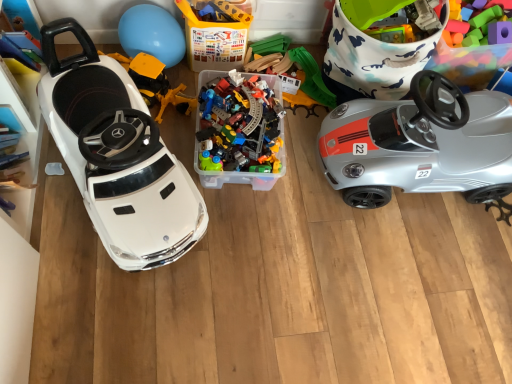
Measure the distance between translucent plastic container at center and camera.

translucent plastic container at center and camera are 4.54 feet apart from each other.

The width and height of the screenshot is (512, 384). What are the coordinates of `white plastic car at left, the 1th car in the left-to-right sequence` in the screenshot? It's located at (118, 156).

The image size is (512, 384). Describe the element at coordinates (118, 156) in the screenshot. I see `white plastic car at left, the 1th car in the left-to-right sequence` at that location.

Describe the element at coordinates (469, 62) in the screenshot. I see `rubberized plastic steering wheel at upper right, acting as the 1th toy starting from the right` at that location.

You are a GUI agent. You are given a task and a screenshot of the screen. Output one action in this format:
    pyautogui.click(x=<x>, y=<y>)
    Task: Click on the translucent plastic container at center
    The image size is (512, 384).
    Given the screenshot: What is the action you would take?
    pyautogui.click(x=215, y=38)

Which is more to the left, rubberized plastic steering wheel at upper right, acting as the 1th toy starting from the right, or blue rubber balloon at upper center?

blue rubber balloon at upper center.

Considering the sizes of objects rubberized plastic steering wheel at upper right, acting as the third toy starting from the left, and blue rubber balloon at upper center in the image provided, who is taller, rubberized plastic steering wheel at upper right, acting as the third toy starting from the left, or blue rubber balloon at upper center?

rubberized plastic steering wheel at upper right, acting as the third toy starting from the left.

Is rubberized plastic steering wheel at upper right, acting as the 1th toy starting from the right, positioned before blue rubber balloon at upper center?

Yes, the depth of rubberized plastic steering wheel at upper right, acting as the 1th toy starting from the right, is less than that of blue rubber balloon at upper center.

Can blue rubber balloon at upper center be found inside white plastic car at left, the 1th car in the left-to-right sequence?

No, blue rubber balloon at upper center is not surrounded by white plastic car at left, the 1th car in the left-to-right sequence.

Which object is wider, white plastic car at left, the 1th car in the left-to-right sequence, or blue rubber balloon at upper center?

With larger width is white plastic car at left, the 1th car in the left-to-right sequence.

What's the angular difference between white plastic car at left, which is the 2th car from right to left, and blue rubber balloon at upper center's facing directions?

The facing directions of white plastic car at left, which is the 2th car from right to left, and blue rubber balloon at upper center are 21.9 degrees apart.

Locate an element on the screen. The width and height of the screenshot is (512, 384). car that is on the left side of blue rubber balloon at upper center is located at coordinates [x=118, y=156].

Considering the relative positions of silver metallic car at right, placed as the 1th car when sorted from right to left, and white plastic car at left, the 1th car in the left-to-right sequence, in the image provided, is silver metallic car at right, placed as the 1th car when sorted from right to left, in front of white plastic car at left, the 1th car in the left-to-right sequence,?

No, it is behind white plastic car at left, the 1th car in the left-to-right sequence.

Locate an element on the screen. car to the right of white plastic car at left, which is the 2th car from right to left is located at coordinates (420, 144).

Which of these two, silver metallic car at right, marked as the second car in a left-to-right arrangement, or white plastic car at left, the 1th car in the left-to-right sequence, is thinner?

silver metallic car at right, marked as the second car in a left-to-right arrangement, is thinner.

Are silver metallic car at right, marked as the second car in a left-to-right arrangement, and white plastic car at left, the 1th car in the left-to-right sequence, far apart?

They are positioned close to each other.

Which of these two, translucent plastic container at center or white plastic car at left, which is the 2th car from right to left, is bigger?

Bigger between the two is white plastic car at left, which is the 2th car from right to left.

Is translucent plastic container at center located outside white plastic car at left, which is the 2th car from right to left?

translucent plastic container at center lies outside white plastic car at left, which is the 2th car from right to left,'s area.

Consider the image. From the image's perspective, which is below, translucent plastic container at center or white plastic car at left, the 1th car in the left-to-right sequence?

white plastic car at left, the 1th car in the left-to-right sequence, appears lower in the image.

Is translucent plastic container at center to the left or to the right of white plastic car at left, the 1th car in the left-to-right sequence, in the image?

From the image, it's evident that translucent plastic container at center is to the right of white plastic car at left, the 1th car in the left-to-right sequence.

From a real-world perspective, is yellow plastic construction vehicle at left, the third toy in the right-to-left sequence, physically located above or below white plastic car at left, which is the 2th car from right to left?

Clearly, from a real-world perspective, yellow plastic construction vehicle at left, the third toy in the right-to-left sequence, is below white plastic car at left, which is the 2th car from right to left.

Does yellow plastic construction vehicle at left, the third toy in the right-to-left sequence, turn towards white plastic car at left, the 1th car in the left-to-right sequence?

No, yellow plastic construction vehicle at left, the third toy in the right-to-left sequence, does not turn towards white plastic car at left, the 1th car in the left-to-right sequence.

Is yellow plastic construction vehicle at left, which is counted as the first toy, starting from the left, positioned in front of white plastic car at left, which is the 2th car from right to left?

No, yellow plastic construction vehicle at left, which is counted as the first toy, starting from the left, is behind white plastic car at left, which is the 2th car from right to left.

Does point (460, 68) appear closer or farther from the camera than point (314, 113)?

Clearly, point (460, 68) is closer to the camera than point (314, 113).

Is the position of rubberized plastic steering wheel at upper right, acting as the third toy starting from the left, more distant than that of translucent plastic train set at center, which is the second toy from right to left?

No, rubberized plastic steering wheel at upper right, acting as the third toy starting from the left, is closer to the camera.

Which of these two, rubberized plastic steering wheel at upper right, acting as the third toy starting from the left, or translucent plastic train set at center, the 2th toy positioned from the left, stands shorter?

translucent plastic train set at center, the 2th toy positioned from the left.

Considering the sizes of objects rubberized plastic steering wheel at upper right, acting as the third toy starting from the left, and translucent plastic train set at center, the 2th toy positioned from the left, in the image provided, who is smaller, rubberized plastic steering wheel at upper right, acting as the third toy starting from the left, or translucent plastic train set at center, the 2th toy positioned from the left,?

With smaller size is translucent plastic train set at center, the 2th toy positioned from the left.

Is yellow plastic construction vehicle at left, which is counted as the first toy, starting from the left, turned away from translucent plastic train set at center, which is the second toy from right to left?

No, yellow plastic construction vehicle at left, which is counted as the first toy, starting from the left,'s orientation is not away from translucent plastic train set at center, which is the second toy from right to left.

Is yellow plastic construction vehicle at left, which is counted as the first toy, starting from the left, taller than translucent plastic train set at center, the 2th toy positioned from the left?

Correct, yellow plastic construction vehicle at left, which is counted as the first toy, starting from the left, is much taller as translucent plastic train set at center, the 2th toy positioned from the left.

In the scene shown: Which object is closer to the camera taking this photo, yellow plastic construction vehicle at left, which is counted as the first toy, starting from the left, or translucent plastic train set at center, the 2th toy positioned from the left?

yellow plastic construction vehicle at left, which is counted as the first toy, starting from the left.

Between yellow plastic construction vehicle at left, which is counted as the first toy, starting from the left, and translucent plastic train set at center, which is the second toy from right to left, which one appears on the right side from the viewer's perspective?

translucent plastic train set at center, which is the second toy from right to left.

I want to click on toy located above the blue rubber balloon at upper center (from a real-world perspective), so click(469, 62).

Locate an element on the screen. The image size is (512, 384). balloon on the right side of white plastic car at left, the 1th car in the left-to-right sequence is located at coordinates (152, 34).

Based on their spatial positions, is translucent plastic container at center or yellow plastic construction vehicle at left, which is counted as the first toy, starting from the left, further from rubberized plastic steering wheel at upper right, acting as the third toy starting from the left?

yellow plastic construction vehicle at left, which is counted as the first toy, starting from the left, is positioned further to the anchor rubberized plastic steering wheel at upper right, acting as the third toy starting from the left.

Based on their spatial positions, is white plastic car at left, which is the 2th car from right to left, or translucent plastic train set at center, which is the second toy from right to left, further from blue rubber balloon at upper center?

Answer: translucent plastic train set at center, which is the second toy from right to left, is positioned further to the anchor blue rubber balloon at upper center.

In the scene shown: Based on their spatial positions, is blue rubber balloon at upper center or yellow plastic construction vehicle at left, which is counted as the first toy, starting from the left, further from rubberized plastic steering wheel at upper right, acting as the 1th toy starting from the right?

Based on the image, blue rubber balloon at upper center appears to be further to rubberized plastic steering wheel at upper right, acting as the 1th toy starting from the right.

Estimate the real-world distances between objects in this image. Which object is further from silver metallic car at right, placed as the 1th car when sorted from right to left, white plastic car at left, the 1th car in the left-to-right sequence, or translucent plastic train set at center, the 2th toy positioned from the left?

white plastic car at left, the 1th car in the left-to-right sequence, is positioned further to the anchor silver metallic car at right, placed as the 1th car when sorted from right to left.

Which object lies nearer to the anchor point white plastic car at left, which is the 2th car from right to left, translucent plastic train set at center, the 2th toy positioned from the left, or translucent plastic container at center?

translucent plastic container at center lies closer to white plastic car at left, which is the 2th car from right to left, than the other object.

From the picture: Which object lies further to the anchor point yellow plastic construction vehicle at left, which is counted as the first toy, starting from the left, translucent plastic train set at center, which is the second toy from right to left, or blue rubber balloon at upper center?

translucent plastic train set at center, which is the second toy from right to left, is further to yellow plastic construction vehicle at left, which is counted as the first toy, starting from the left.

Based on their spatial positions, is translucent plastic train set at center, which is the second toy from right to left, or silver metallic car at right, placed as the 1th car when sorted from right to left, further from yellow plastic construction vehicle at left, the third toy in the right-to-left sequence?

silver metallic car at right, placed as the 1th car when sorted from right to left, is further to yellow plastic construction vehicle at left, the third toy in the right-to-left sequence.

Which object lies further to the anchor point translucent plastic train set at center, which is the second toy from right to left, silver metallic car at right, marked as the second car in a left-to-right arrangement, or rubberized plastic steering wheel at upper right, acting as the third toy starting from the left?

rubberized plastic steering wheel at upper right, acting as the third toy starting from the left.

Locate an element on the screen. The width and height of the screenshot is (512, 384). car between yellow plastic construction vehicle at left, which is counted as the first toy, starting from the left, and rubberized plastic steering wheel at upper right, acting as the third toy starting from the left is located at coordinates (420, 144).

The image size is (512, 384). Find the location of `storage box between blue rubber balloon at upper center and silver metallic car at right, placed as the 1th car when sorted from right to left`. storage box between blue rubber balloon at upper center and silver metallic car at right, placed as the 1th car when sorted from right to left is located at coordinates (215, 38).

Locate an element on the screen. The width and height of the screenshot is (512, 384). storage box positioned between white plastic car at left, which is the 2th car from right to left, and blue rubber balloon at upper center from near to far is located at coordinates (215, 38).

The height and width of the screenshot is (384, 512). I want to click on car between white plastic car at left, the 1th car in the left-to-right sequence, and rubberized plastic steering wheel at upper right, acting as the 1th toy starting from the right, in the horizontal direction, so click(420, 144).